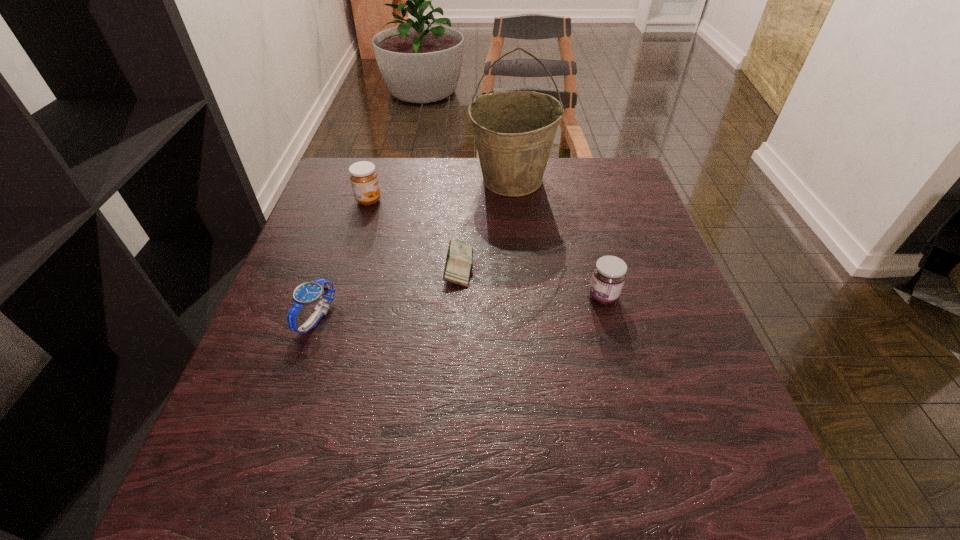
Locate an element on the screen. This screenshot has width=960, height=540. vacant point located between the farther jam and the rightmost object is located at coordinates (486, 248).

Find the location of a particular element. The image size is (960, 540). free space between the rightmost object and the fourth tallest object is located at coordinates pos(460,307).

The height and width of the screenshot is (540, 960). Identify the location of vacant space that's between the farther jam and the nearer jam. 486,248.

I want to click on free space between the watch and the right jam, so click(460, 307).

Find the location of `object that is the closest to the watch`. object that is the closest to the watch is located at coordinates (458, 263).

Select which object is the third closest to the farther jam. Please provide its 2D coordinates. Your answer should be formatted as a tuple, i.e. [(x, y)], where the tuple contains the x and y coordinates of a point satisfying the conditions above.

[(308, 293)]

Find the location of a particular element. blank space that satisfies the following two spatial constraints: 1. on the front label of the farther jam; 2. on the front side of the fourth tallest object is located at coordinates (333, 318).